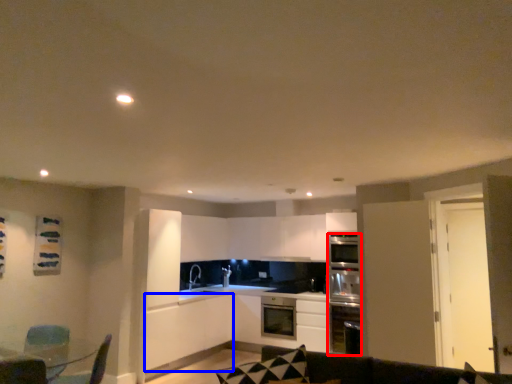
Question: Which object appears closest to the camera in this image, oven (highlighted by a red box) or cabinetry (highlighted by a blue box)?

Choices:
 (A) oven
 (B) cabinetry

Answer: (B)